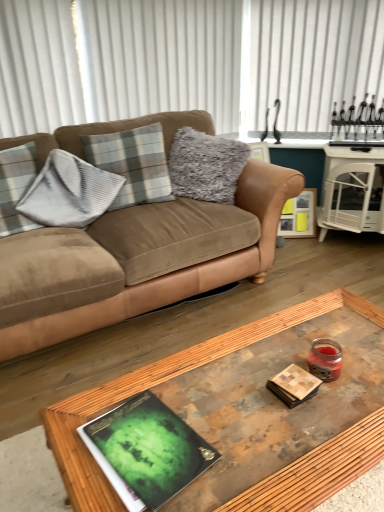
Question: Is wooden glass coffee table at center at the right side of wooden picture frame at right?

Choices:
 (A) no
 (B) yes

Answer: (A)

Question: Does wooden glass coffee table at center have a larger size compared to wooden picture frame at right?

Choices:
 (A) yes
 (B) no

Answer: (A)

Question: Is wooden glass coffee table at center surrounding wooden picture frame at right?

Choices:
 (A) no
 (B) yes

Answer: (A)

Question: Is wooden glass coffee table at center not within wooden picture frame at right?

Choices:
 (A) no
 (B) yes

Answer: (B)

Question: Is wooden glass coffee table at center taller than wooden picture frame at right?

Choices:
 (A) no
 (B) yes

Answer: (B)

Question: Is wooden glass coffee table at center oriented towards wooden picture frame at right?

Choices:
 (A) yes
 (B) no

Answer: (B)

Question: Can you confirm if green matte book at center is wider than matte brown book at center?

Choices:
 (A) no
 (B) yes

Answer: (B)

Question: Can you confirm if green matte book at center is shorter than matte brown book at center?

Choices:
 (A) no
 (B) yes

Answer: (B)

Question: Considering the relative sizes of green matte book at center and matte brown book at center in the image provided, is green matte book at center smaller than matte brown book at center?

Choices:
 (A) no
 (B) yes

Answer: (A)

Question: From a real-world perspective, is green matte book at center on top of matte brown book at center?

Choices:
 (A) no
 (B) yes

Answer: (A)

Question: Can you confirm if green matte book at center is positioned to the left of matte brown book at center?

Choices:
 (A) no
 (B) yes

Answer: (B)

Question: Is green matte book at center closer to the viewer compared to matte brown book at center?

Choices:
 (A) no
 (B) yes

Answer: (B)

Question: Does gray plaid pillow at left, the first pillow when ordered from left to right, come behind green matte book at center?

Choices:
 (A) no
 (B) yes

Answer: (B)